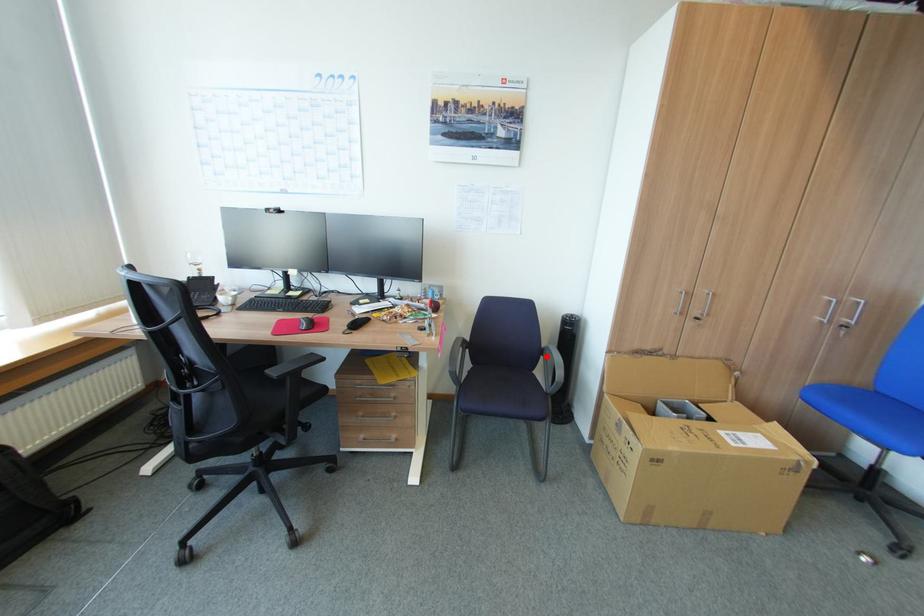
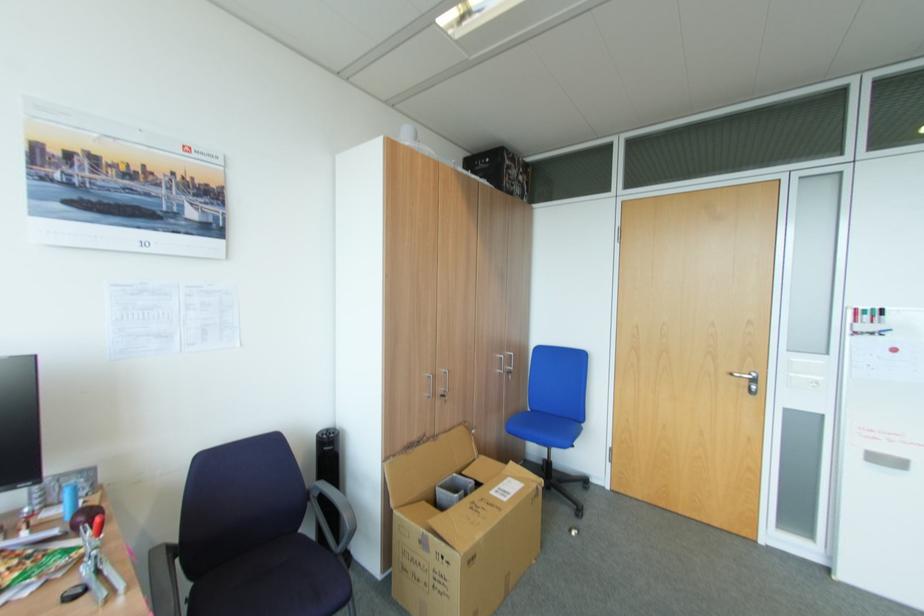
Locate, in the second image, the point that corresponds to the highlighted location in the first image.

(313, 501)